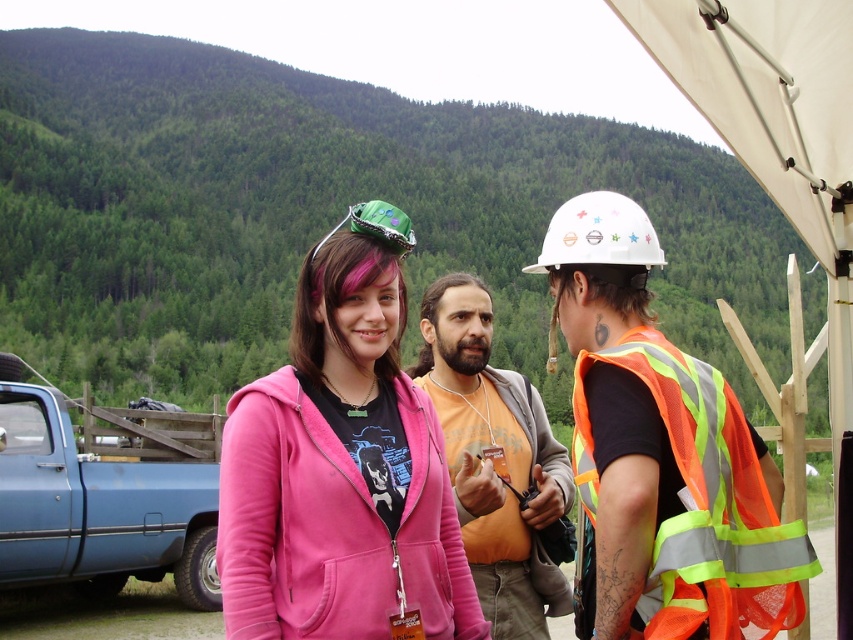
You are standing at point (612, 452) and want to move to point (312, 573). Is the destination point in front of or behind you?

Answer: The destination point (312, 573) is behind point (612, 452), so it is behind you.

Where is the blue matte truck at lower left located in the image?

The blue matte truck at lower left is located at point (97, 508).